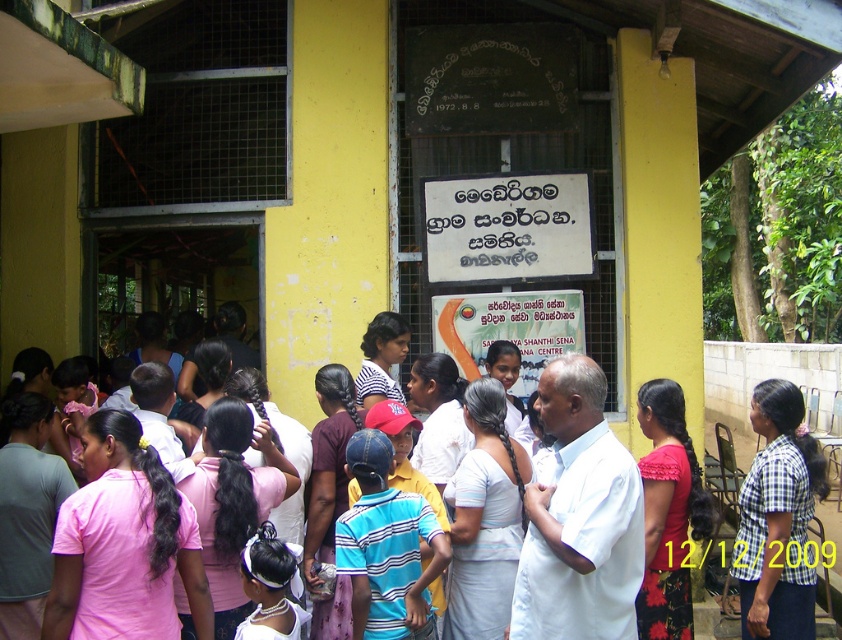
Question: Which point is farther from the camera taking this photo?

Choices:
 (A) (273, 396)
 (B) (577, 205)

Answer: (B)

Question: Observing the image, what is the correct spatial positioning of pink cotton shirt at center in reference to white paper sign at center?

Choices:
 (A) left
 (B) right

Answer: (B)

Question: Which object appears closest to the camera in this image?

Choices:
 (A) white paper sign at center
 (B) pink cotton shirt at center

Answer: (B)

Question: Does pink cotton shirt at center have a larger size compared to white paper sign at center?

Choices:
 (A) yes
 (B) no

Answer: (A)

Question: Can you confirm if pink cotton shirt at center is positioned below white paper sign at center?

Choices:
 (A) yes
 (B) no

Answer: (A)